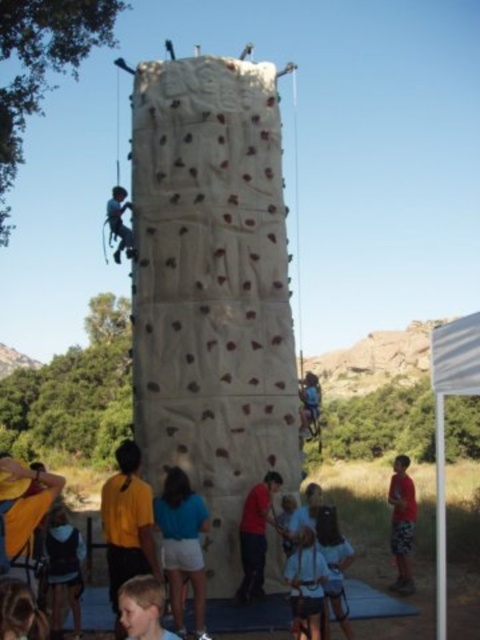
Question: Does matte blue shirt at lower center come behind red cotton shorts at lower right?

Choices:
 (A) no
 (B) yes

Answer: (A)

Question: Does white textured climbing wall at center appear under matte blue shirt at lower center?

Choices:
 (A) no
 (B) yes

Answer: (A)

Question: Among these objects, which one is farthest from the camera?

Choices:
 (A) red cotton shorts at lower right
 (B) white textured climbing wall at center
 (C) matte blue shirt at lower center
 (D) white fabric canopy at right

Answer: (A)

Question: Which of the following is the farthest from the observer?

Choices:
 (A) (110, 218)
 (B) (400, 477)
 (C) (220, 262)

Answer: (B)

Question: Which of these objects is positioned closest to the white fabric canopy at right?

Choices:
 (A) matte blue harness at upper center
 (B) red cotton shorts at lower right

Answer: (B)

Question: Is matte blue shirt at lower center below red cotton shorts at lower right?

Choices:
 (A) no
 (B) yes

Answer: (A)